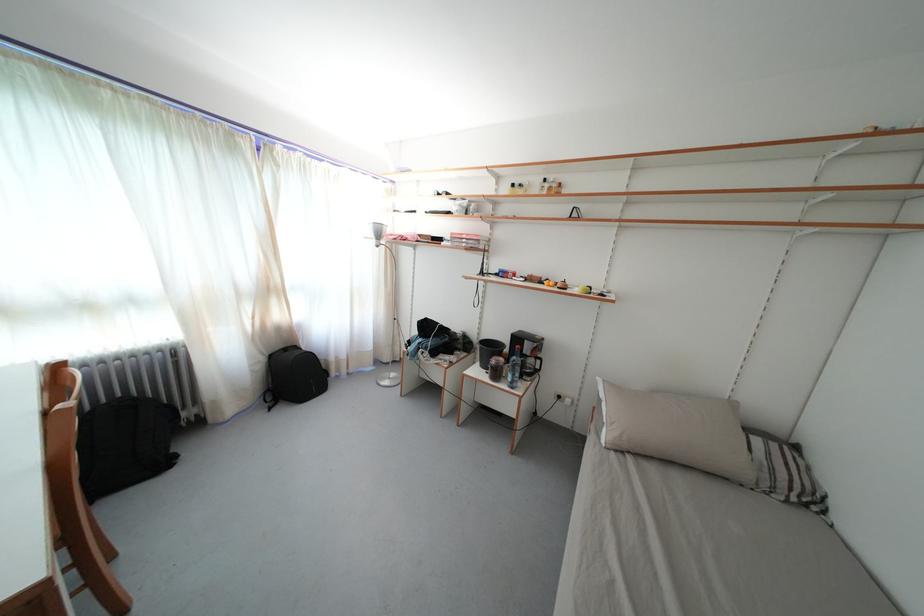
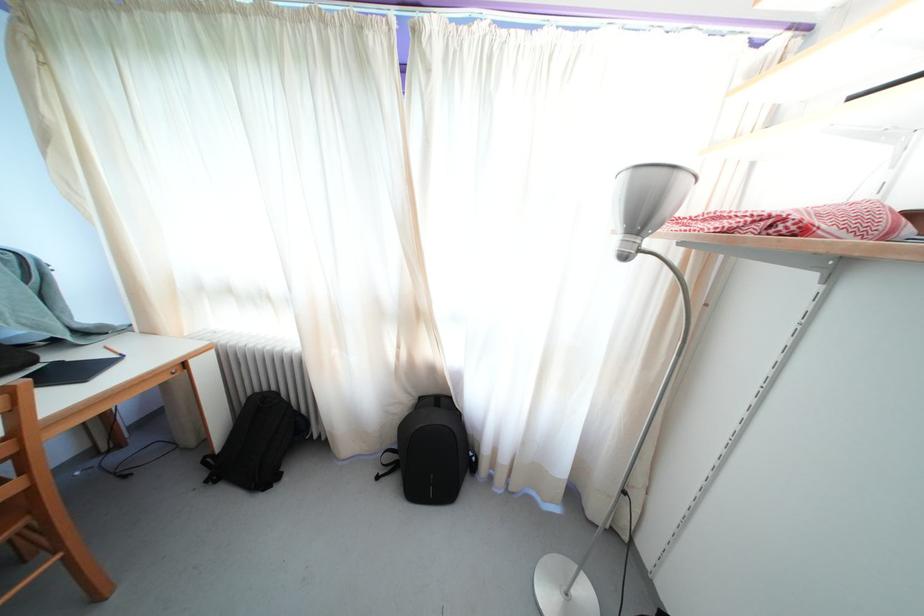
In the second image, find the point that corresponds to [275,296] in the first image.

(421, 321)